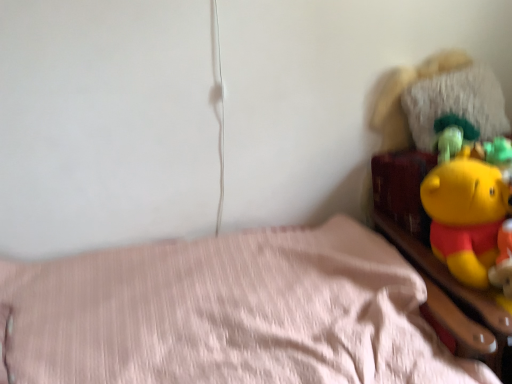
Describe the element at coordinates (444, 176) in the screenshot. I see `yellow plush toy at upper right` at that location.

Find the location of `pink fabric bed at lower left`. pink fabric bed at lower left is located at coordinates (227, 314).

Does fuzzy white pillow at upper right have a smaller size compared to yellow plush toy at upper right?

Yes.

Where is `pillow positioned vertically above the yellow plush toy at upper right (from a real-world perspective)`? This screenshot has height=384, width=512. pillow positioned vertically above the yellow plush toy at upper right (from a real-world perspective) is located at coordinates (456, 106).

Does fuzzy white pillow at upper right lie in front of yellow plush toy at upper right?

No, fuzzy white pillow at upper right is further to the viewer.

Consider the image. Which is more to the left, fuzzy white pillow at upper right or yellow plush toy at upper right?

fuzzy white pillow at upper right.

Does pink fabric bed at lower left have a larger size compared to fuzzy white pillow at upper right?

Yes, pink fabric bed at lower left is bigger than fuzzy white pillow at upper right.

From the image's perspective, between pink fabric bed at lower left and fuzzy white pillow at upper right, who is located below?

pink fabric bed at lower left, from the image's perspective.

In the scene shown: Is fuzzy white pillow at upper right at the back of pink fabric bed at lower left?

pink fabric bed at lower left is not turned away from fuzzy white pillow at upper right.

Is fuzzy white pillow at upper right oriented away from pink fabric bed at lower left?

No, fuzzy white pillow at upper right's orientation is not away from pink fabric bed at lower left.

Is fuzzy white pillow at upper right next to pink fabric bed at lower left and touching it?

No, fuzzy white pillow at upper right is not with pink fabric bed at lower left.

Based on the photo, can you tell me how much fuzzy white pillow at upper right and pink fabric bed at lower left differ in facing direction?

The angle between the facing direction of fuzzy white pillow at upper right and the facing direction of pink fabric bed at lower left is 0.000576 degrees.

Is fuzzy white pillow at upper right to the left or to the right of pink fabric bed at lower left in the image?

In the image, fuzzy white pillow at upper right appears on the right side of pink fabric bed at lower left.

Which is in front, pink fabric bed at lower left or yellow plush toy at upper right?

pink fabric bed at lower left is more forward.

How distant is pink fabric bed at lower left from yellow plush toy at upper right?

The distance of pink fabric bed at lower left from yellow plush toy at upper right is 25.04 inches.

Considering the relative positions of pink fabric bed at lower left and yellow plush toy at upper right in the image provided, is pink fabric bed at lower left to the right of yellow plush toy at upper right from the viewer's perspective?

No, pink fabric bed at lower left is not to the right of yellow plush toy at upper right.

Is pink fabric bed at lower left situated inside yellow plush toy at upper right or outside?

pink fabric bed at lower left cannot be found inside yellow plush toy at upper right.

From the picture: Could you tell me if yellow plush toy at upper right is turned towards fuzzy white pillow at upper right?

No.

Which point is more distant from viewer, (437, 272) or (439, 124)?

The point (439, 124) is farther.

From a real-world perspective, who is located lower, yellow plush toy at upper right or fuzzy white pillow at upper right?

yellow plush toy at upper right.

Consider the image. Considering the sizes of yellow plush toy at upper right and fuzzy white pillow at upper right in the image, is yellow plush toy at upper right wider or thinner than fuzzy white pillow at upper right?

In the image, yellow plush toy at upper right appears to be wider than fuzzy white pillow at upper right.

From a real-world perspective, is yellow plush toy at upper right physically above pink fabric bed at lower left?

Yes.

Does yellow plush toy at upper right appear on the left side of pink fabric bed at lower left?

No, yellow plush toy at upper right is not to the left of pink fabric bed at lower left.

Between yellow plush toy at upper right and pink fabric bed at lower left, which one is positioned behind?

yellow plush toy at upper right is further away from the camera.

In the image, there is a yellow plush toy at upper right. In order to click on pillow above it (from the image's perspective) in this screenshot , I will do `click(456, 106)`.

Find the location of a particular element. The width and height of the screenshot is (512, 384). pillow on the right side of pink fabric bed at lower left is located at coordinates (456, 106).

Which object lies nearer to the anchor point yellow plush toy at upper right, pink fabric bed at lower left or fuzzy white pillow at upper right?

fuzzy white pillow at upper right.

In the scene shown: Based on their spatial positions, is pink fabric bed at lower left or yellow plush toy at upper right closer to fuzzy white pillow at upper right?

Based on the image, yellow plush toy at upper right appears to be nearer to fuzzy white pillow at upper right.

Looking at the image, which one is located further to fuzzy white pillow at upper right, yellow plush toy at upper right or pink fabric bed at lower left?

pink fabric bed at lower left.

From the image, which object appears to be nearer to pink fabric bed at lower left, yellow plush toy at upper right or fuzzy white pillow at upper right?

yellow plush toy at upper right.

Based on their spatial positions, is fuzzy white pillow at upper right or yellow plush toy at upper right further from pink fabric bed at lower left?

The object further to pink fabric bed at lower left is fuzzy white pillow at upper right.

Estimate the real-world distances between objects in this image. Which object is closer to yellow plush toy at upper right, fuzzy white pillow at upper right or pink fabric bed at lower left?

Based on the image, fuzzy white pillow at upper right appears to be nearer to yellow plush toy at upper right.

Locate an element on the screen. pillow between pink fabric bed at lower left and yellow plush toy at upper right is located at coordinates (456, 106).